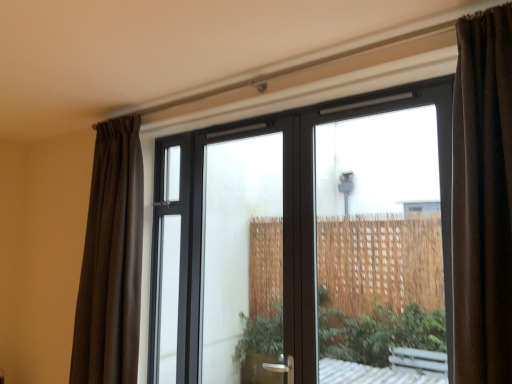
Describe the element at coordinates (303, 240) in the screenshot. I see `transparent glass window at center` at that location.

Image resolution: width=512 pixels, height=384 pixels. Describe the element at coordinates (222, 251) in the screenshot. I see `transparent glass door at center` at that location.

Where is `brown sheer curtain at left`? The image size is (512, 384). brown sheer curtain at left is located at coordinates (111, 260).

At what (x,y) coordinates should I click in order to perform the action: click on transparent glass window at center. Please return your answer as a coordinate pair (x, y). The width and height of the screenshot is (512, 384). Looking at the image, I should click on 303,240.

Is point (228, 157) farther from viewer compared to point (158, 153)?

Yes, it is.

Is transparent glass door at center not near transparent glass window at center?

Yes, transparent glass door at center and transparent glass window at center are quite far apart.

Is transparent glass door at center bigger than transparent glass window at center?

Actually, transparent glass door at center might be smaller than transparent glass window at center.

From the picture: Who is more distant, transparent glass door at center or transparent glass window at center?

transparent glass door at center is further from the camera.

How distant is transparent glass door at center from brown sheer curtain at left?

transparent glass door at center and brown sheer curtain at left are 57.17 centimeters apart.

In the scene shown: How different are the orientations of transparent glass door at center and brown sheer curtain at left in degrees?

3.49 degrees.

Considering the relative positions of transparent glass door at center and brown sheer curtain at left in the image provided, is transparent glass door at center to the left of brown sheer curtain at left from the viewer's perspective?

No, transparent glass door at center is not to the left of brown sheer curtain at left.

Considering the points (211, 332) and (106, 301), which point is in front, point (211, 332) or point (106, 301)?

The point (106, 301) is in front.

From a real-world perspective, is transparent glass window at center under brown sheer curtain at left?

Correct, in the physical world, transparent glass window at center is lower than brown sheer curtain at left.

Is point (351, 277) positioned behind point (100, 293)?

That is True.

Is brown sheer curtain at left at the back of transparent glass window at center?

No, transparent glass window at center is not facing away from brown sheer curtain at left.

Is brown sheer curtain at left oriented towards transparent glass window at center?

No.

Which object is closer to the camera taking this photo, brown sheer curtain at left or transparent glass window at center?

transparent glass window at center is more forward.

Is brown sheer curtain at left positioned beyond the bounds of transparent glass window at center?

That's correct, brown sheer curtain at left is outside of transparent glass window at center.

How many degrees apart are the facing directions of brown sheer curtain at left and transparent glass window at center?

They differ by 4.23 degrees in their facing directions.

Considering the relative positions of brown sheer curtain at left and transparent glass door at center in the image provided, is brown sheer curtain at left to the right of transparent glass door at center from the viewer's perspective?

Incorrect, brown sheer curtain at left is not on the right side of transparent glass door at center.

Are brown sheer curtain at left and transparent glass door at center far apart?

No, brown sheer curtain at left is in close proximity to transparent glass door at center.

From the image's perspective, is brown sheer curtain at left located above or below transparent glass door at center?

Clearly, from the image's perspective, brown sheer curtain at left is above transparent glass door at center.

Is transparent glass window at center next to transparent glass door at center?

No, transparent glass window at center is not touching transparent glass door at center.

Considering the sizes of objects transparent glass window at center and transparent glass door at center in the image provided, who is shorter, transparent glass window at center or transparent glass door at center?

With less height is transparent glass door at center.

From a real-world perspective, is transparent glass window at center located higher than transparent glass door at center?

Yes.

The height and width of the screenshot is (384, 512). Identify the location of window in front of the transparent glass door at center. (303, 240).

Image resolution: width=512 pixels, height=384 pixels. I want to click on curtain above the transparent glass door at center (from a real-world perspective), so click(x=111, y=260).

Based on their spatial positions, is transparent glass door at center or brown sheer curtain at left closer to transparent glass window at center?

transparent glass door at center is positioned closer to the anchor transparent glass window at center.

Based on their spatial positions, is transparent glass window at center or brown sheer curtain at left closer to transparent glass door at center?

brown sheer curtain at left lies closer to transparent glass door at center than the other object.

Looking at the image, which one is located closer to brown sheer curtain at left, transparent glass window at center or transparent glass door at center?

Among the two, transparent glass door at center is located nearer to brown sheer curtain at left.

From the image, which object appears to be farther from transparent glass window at center, brown sheer curtain at left or transparent glass door at center?

brown sheer curtain at left.

Consider the image. From the image, which object appears to be farther from transparent glass door at center, brown sheer curtain at left or transparent glass window at center?

The object further to transparent glass door at center is transparent glass window at center.

From the image, which object appears to be farther from brown sheer curtain at left, transparent glass door at center or transparent glass window at center?

Based on the image, transparent glass window at center appears to be further to brown sheer curtain at left.

You are a GUI agent. You are given a task and a screenshot of the screen. Output one action in this format:
    pyautogui.click(x=<x>, y=<y>)
    Task: Click on the screen door situated between brown sheer curtain at left and transparent glass window at center from left to right
    The image size is (512, 384).
    Given the screenshot: What is the action you would take?
    pyautogui.click(x=222, y=251)